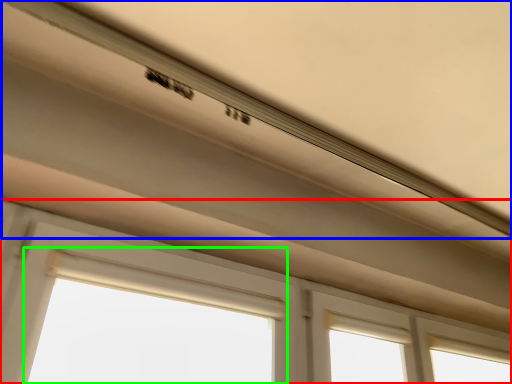
Question: Estimate the real-world distances between objects in this image. Which object is farther from window (highlighted by a red box), exhaust hood (highlighted by a blue box) or bay window (highlighted by a green box)?

Choices:
 (A) exhaust hood
 (B) bay window

Answer: (A)